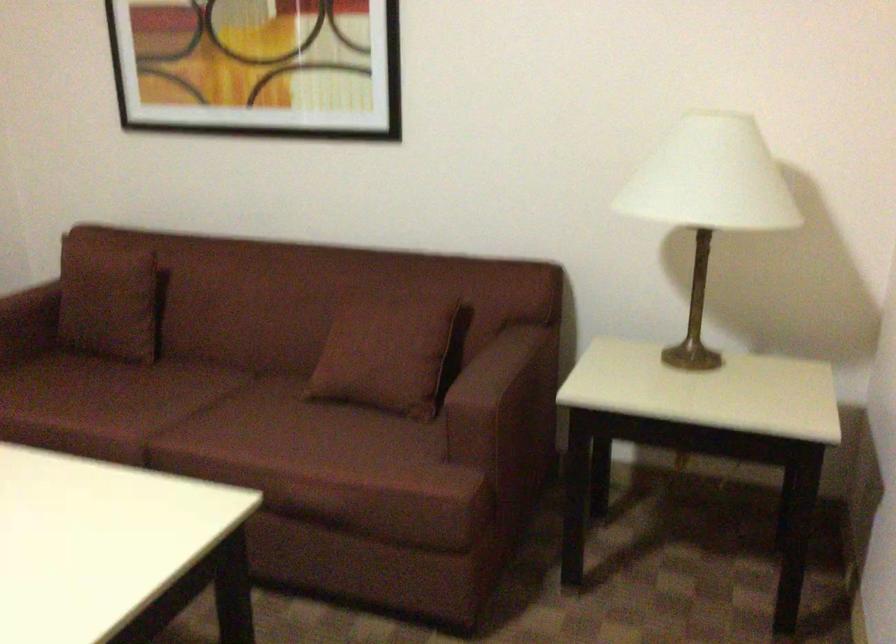
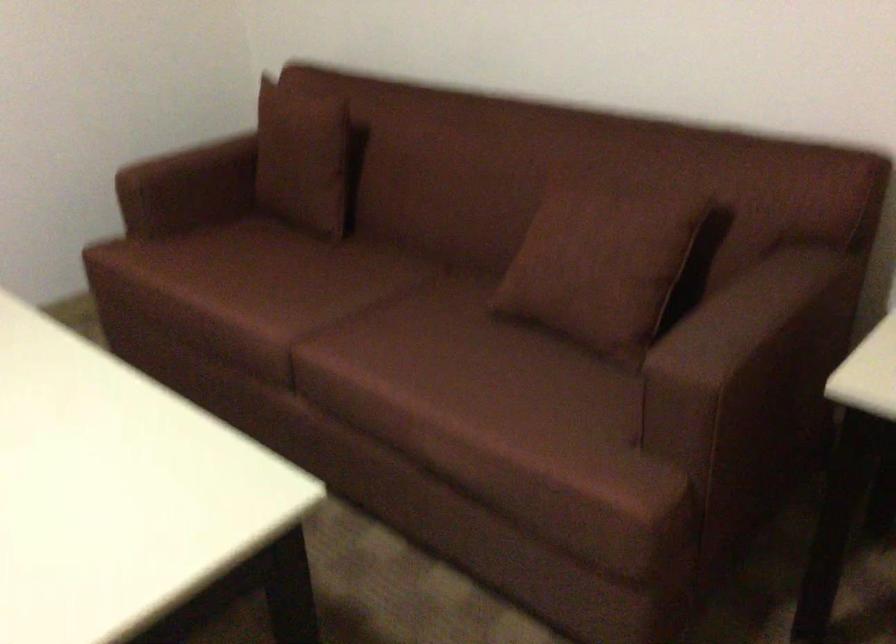
The point at (117,295) is marked in the first image. Where is the corresponding point in the second image?

(306, 158)